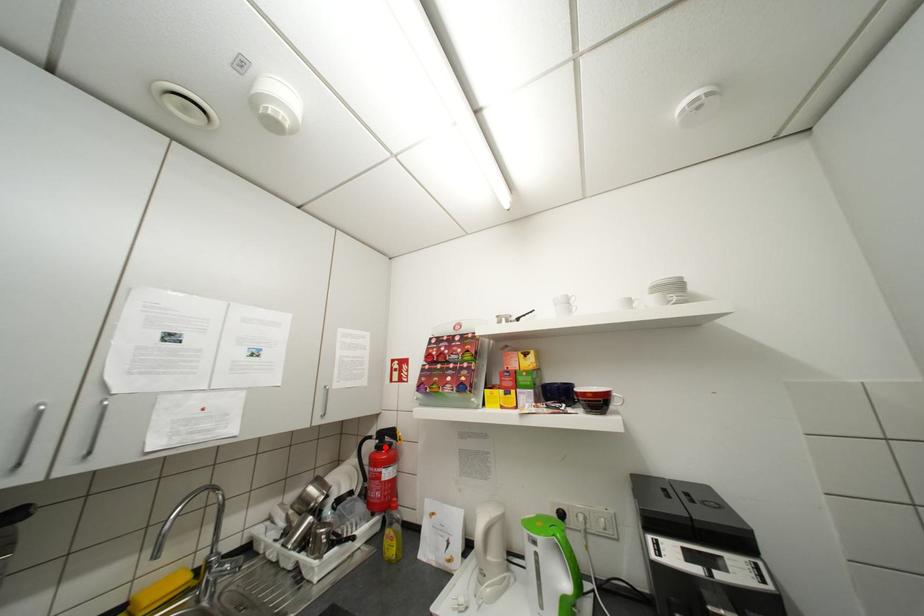
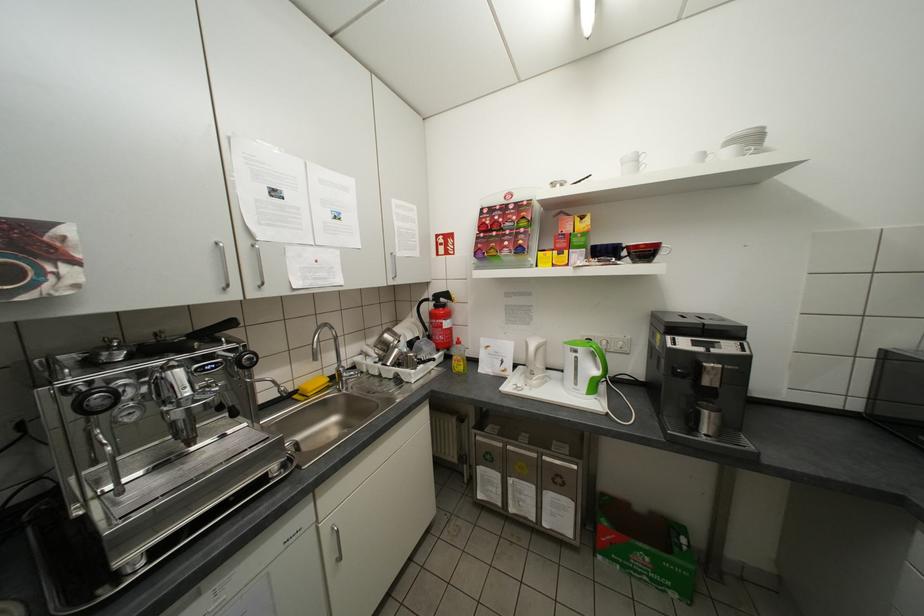
Locate, in the second image, the point that corresponds to the highlighted location in the first image.

(444, 306)